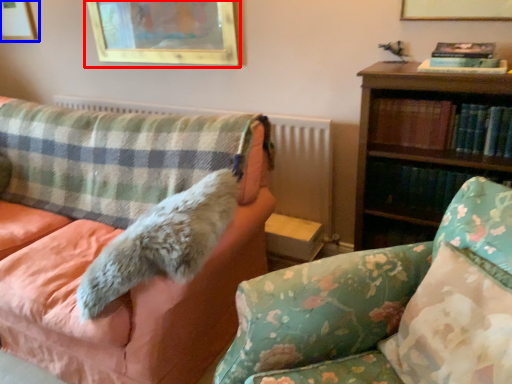
Question: Which point is further to the camera, picture frame (highlighted by a red box) or picture frame (highlighted by a blue box)?

Choices:
 (A) picture frame
 (B) picture frame

Answer: (B)